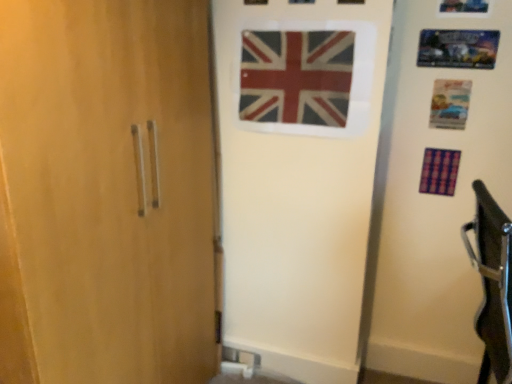
The height and width of the screenshot is (384, 512). Describe the element at coordinates (296, 77) in the screenshot. I see `red and white fabric flag at center, the 1th flag when ordered from left to right` at that location.

Image resolution: width=512 pixels, height=384 pixels. I want to click on red and white fabric flag at center, positioned as the 2th flag in back-to-front order, so tap(296, 77).

In the scene shown: What is the approximate height of red and white fabric flag at center, the 1th flag when ordered from left to right?

The height of red and white fabric flag at center, the 1th flag when ordered from left to right, is 15.41 inches.

Find the location of a particular element. purple fabric flag at right, which is the second flag in left-to-right order is located at coordinates (439, 171).

What do you see at coordinates (439, 171) in the screenshot? I see `purple fabric flag at right, which is counted as the first flag, starting from the right` at bounding box center [439, 171].

What are the coordinates of `red and white fabric flag at center, which is the 2th flag in right-to-left order` in the screenshot? It's located at (296, 77).

Considering the positions of objects red and white fabric flag at center, the 1th flag from the top, and purple fabric flag at right, which is the second flag in left-to-right order, in the image provided, who is more to the left, red and white fabric flag at center, the 1th flag from the top, or purple fabric flag at right, which is the second flag in left-to-right order,?

red and white fabric flag at center, the 1th flag from the top.

Is red and white fabric flag at center, which is the 2th flag in right-to-left order, positioned before purple fabric flag at right, which is the second flag in left-to-right order?

Yes.

Is point (278, 85) closer or farther from the camera than point (432, 179)?

Clearly, point (278, 85) is closer to the camera than point (432, 179).

From the image's perspective, which is below, red and white fabric flag at center, which is counted as the 1th flag, starting from the front, or purple fabric flag at right, which is the second flag in left-to-right order?

purple fabric flag at right, which is the second flag in left-to-right order, from the image's perspective.

From a real-world perspective, is red and white fabric flag at center, positioned as the 2th flag in back-to-front order, positioned over purple fabric flag at right, arranged as the 1th flag when ordered from the bottom, based on gravity?

Correct, in the physical world, red and white fabric flag at center, positioned as the 2th flag in back-to-front order, is higher than purple fabric flag at right, arranged as the 1th flag when ordered from the bottom.

In terms of width, does red and white fabric flag at center, which is counted as the 1th flag, starting from the front, look wider or thinner when compared to purple fabric flag at right, the 2th flag when ordered from front to back?

In the image, red and white fabric flag at center, which is counted as the 1th flag, starting from the front, appears to be more narrow than purple fabric flag at right, the 2th flag when ordered from front to back.

Considering the sizes of objects red and white fabric flag at center, positioned as the 2th flag in back-to-front order, and purple fabric flag at right, which is the second flag in left-to-right order, in the image provided, who is taller, red and white fabric flag at center, positioned as the 2th flag in back-to-front order, or purple fabric flag at right, which is the second flag in left-to-right order,?

With more height is red and white fabric flag at center, positioned as the 2th flag in back-to-front order.

In terms of size, does red and white fabric flag at center, marked as the 2th flag in a bottom-to-top arrangement, appear bigger or smaller than purple fabric flag at right, the 2th flag when ordered from front to back?

In the image, red and white fabric flag at center, marked as the 2th flag in a bottom-to-top arrangement, appears to be larger than purple fabric flag at right, the 2th flag when ordered from front to back.

Is red and white fabric flag at center, the 1th flag from the top, located outside purple fabric flag at right, acting as the 1th flag starting from the back?

Indeed, red and white fabric flag at center, the 1th flag from the top, is completely outside purple fabric flag at right, acting as the 1th flag starting from the back.

Is red and white fabric flag at center, marked as the 2th flag in a bottom-to-top arrangement, far from purple fabric flag at right, the 2th flag when ordered from front to back?

red and white fabric flag at center, marked as the 2th flag in a bottom-to-top arrangement, is near purple fabric flag at right, the 2th flag when ordered from front to back, not far away.

Is red and white fabric flag at center, marked as the 2th flag in a bottom-to-top arrangement, oriented towards purple fabric flag at right, the 2th flag when ordered from front to back?

No, red and white fabric flag at center, marked as the 2th flag in a bottom-to-top arrangement, is not turned towards purple fabric flag at right, the 2th flag when ordered from front to back.

Where is `flag located in front of the purple fabric flag at right, the 2th flag when ordered from front to back`? The width and height of the screenshot is (512, 384). flag located in front of the purple fabric flag at right, the 2th flag when ordered from front to back is located at coordinates (296, 77).

Based on their positions, is purple fabric flag at right, which is counted as the first flag, starting from the right, located to the left or right of red and white fabric flag at center, positioned as the 2th flag in back-to-front order?

purple fabric flag at right, which is counted as the first flag, starting from the right, is positioned on red and white fabric flag at center, positioned as the 2th flag in back-to-front order,'s right side.

Is purple fabric flag at right, placed as the second flag when sorted from top to bottom, positioned before red and white fabric flag at center, the 1th flag from the top?

No.

Between point (445, 178) and point (273, 122), which one is positioned in front?

The point (273, 122) is closer to the camera.

From the image's perspective, relative to red and white fabric flag at center, marked as the 2th flag in a bottom-to-top arrangement, is purple fabric flag at right, acting as the 1th flag starting from the back, above or below?

From the image's perspective, purple fabric flag at right, acting as the 1th flag starting from the back, appears below red and white fabric flag at center, marked as the 2th flag in a bottom-to-top arrangement.

Based on the photo, from a real-world perspective, who is located lower, purple fabric flag at right, arranged as the 1th flag when ordered from the bottom, or red and white fabric flag at center, which is counted as the 1th flag, starting from the front?

purple fabric flag at right, arranged as the 1th flag when ordered from the bottom, from a real-world perspective.

Considering the relative sizes of purple fabric flag at right, arranged as the 1th flag when ordered from the bottom, and red and white fabric flag at center, positioned as the 2th flag in back-to-front order, in the image provided, is purple fabric flag at right, arranged as the 1th flag when ordered from the bottom, thinner than red and white fabric flag at center, positioned as the 2th flag in back-to-front order,?

No, purple fabric flag at right, arranged as the 1th flag when ordered from the bottom, is not thinner than red and white fabric flag at center, positioned as the 2th flag in back-to-front order.

Can you confirm if purple fabric flag at right, the 2th flag when ordered from front to back, is shorter than red and white fabric flag at center, marked as the 2th flag in a bottom-to-top arrangement?

Correct, purple fabric flag at right, the 2th flag when ordered from front to back, is not as tall as red and white fabric flag at center, marked as the 2th flag in a bottom-to-top arrangement.

From the picture: Considering the sizes of purple fabric flag at right, the 2th flag when ordered from front to back, and red and white fabric flag at center, marked as the 2th flag in a bottom-to-top arrangement, in the image, is purple fabric flag at right, the 2th flag when ordered from front to back, bigger or smaller than red and white fabric flag at center, marked as the 2th flag in a bottom-to-top arrangement,?

In the image, purple fabric flag at right, the 2th flag when ordered from front to back, appears to be smaller than red and white fabric flag at center, marked as the 2th flag in a bottom-to-top arrangement.

Is red and white fabric flag at center, marked as the 2th flag in a bottom-to-top arrangement, inside purple fabric flag at right, which is counted as the first flag, starting from the right?

No, purple fabric flag at right, which is counted as the first flag, starting from the right, does not contain red and white fabric flag at center, marked as the 2th flag in a bottom-to-top arrangement.

Is purple fabric flag at right, which is counted as the first flag, starting from the right, placed right next to red and white fabric flag at center, positioned as the 2th flag in back-to-front order?

They are not placed beside each other.

Does purple fabric flag at right, acting as the 1th flag starting from the back, turn towards red and white fabric flag at center, the 1th flag when ordered from left to right?

No, purple fabric flag at right, acting as the 1th flag starting from the back, does not turn towards red and white fabric flag at center, the 1th flag when ordered from left to right.

Based on the photo, how distant is purple fabric flag at right, which is the second flag in left-to-right order, from red and white fabric flag at center, which is counted as the 1th flag, starting from the front?

purple fabric flag at right, which is the second flag in left-to-right order, and red and white fabric flag at center, which is counted as the 1th flag, starting from the front, are 26.00 inches apart from each other.

Find the location of `flag that is above the purple fabric flag at right, arranged as the 1th flag when ordered from the bottom (from a real-world perspective)`. flag that is above the purple fabric flag at right, arranged as the 1th flag when ordered from the bottom (from a real-world perspective) is located at coordinates (296, 77).

You are a GUI agent. You are given a task and a screenshot of the screen. Output one action in this format:
    pyautogui.click(x=<x>, y=<y>)
    Task: Click on the flag that is above the purple fabric flag at right, placed as the second flag when sorted from top to bottom (from the image's perspective)
    This screenshot has width=512, height=384.
    Given the screenshot: What is the action you would take?
    pyautogui.click(x=296, y=77)

The image size is (512, 384). Find the location of `flag located above the purple fabric flag at right, which is the second flag in left-to-right order (from a real-world perspective)`. flag located above the purple fabric flag at right, which is the second flag in left-to-right order (from a real-world perspective) is located at coordinates (x=296, y=77).